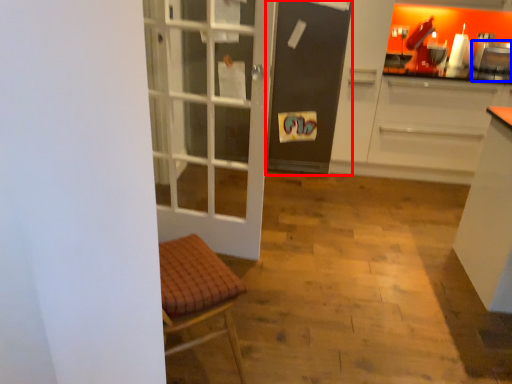
Question: Which of the following is the farthest to the observer, screen door (highlighted by a red box) or appliance (highlighted by a blue box)?

Choices:
 (A) screen door
 (B) appliance

Answer: (B)